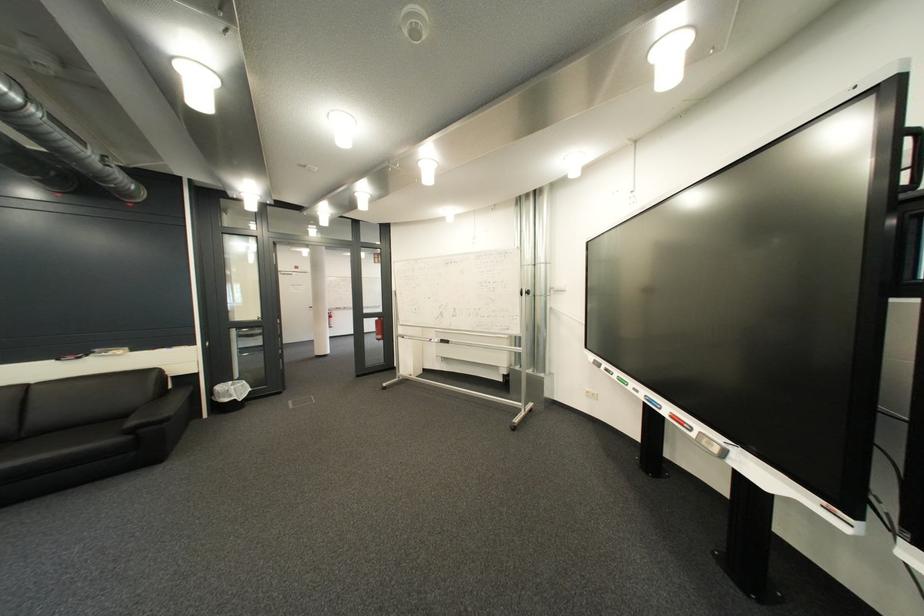
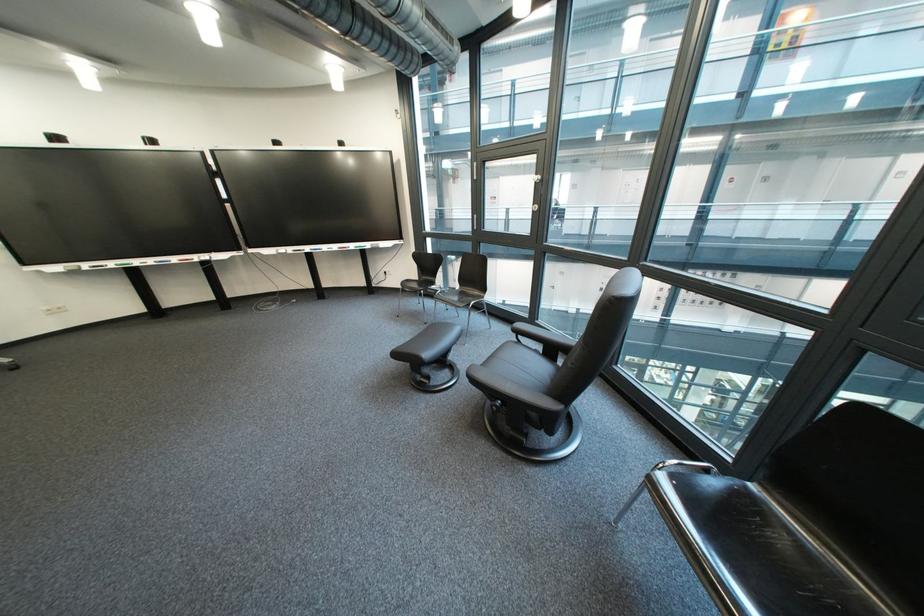
The point at (633, 379) is marked in the first image. Where is the corresponding point in the second image?

(130, 267)